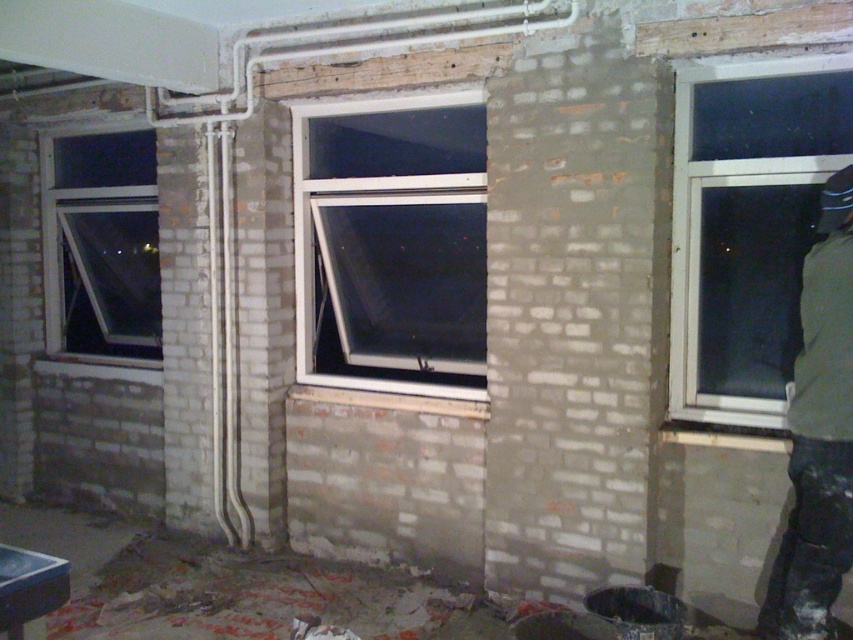
Between green fabric jacket at right and clear glass window at left, which one appears on the right side from the viewer's perspective?

Positioned to the right is green fabric jacket at right.

Find the location of a particular element. green fabric jacket at right is located at coordinates coord(817,435).

The height and width of the screenshot is (640, 853). In order to click on green fabric jacket at right in this screenshot , I will do pos(817,435).

Does clear glass window at upper right appear over clear glass window at left?

Actually, clear glass window at upper right is below clear glass window at left.

Between point (791, 259) and point (77, 168), which one is positioned in front?

Point (791, 259)

Identify the location of clear glass window at upper right. (747, 227).

Can you confirm if white plastic window at center is smaller than green fabric jacket at right?

Actually, white plastic window at center might be larger than green fabric jacket at right.

Can you confirm if white plastic window at center is shorter than green fabric jacket at right?

Result: Correct, white plastic window at center is not as tall as green fabric jacket at right.

Who is more distant from viewer, (x=416, y=109) or (x=807, y=300)?

Point (x=416, y=109)

Image resolution: width=853 pixels, height=640 pixels. What are the coordinates of `white plastic window at center` in the screenshot? It's located at (392, 243).